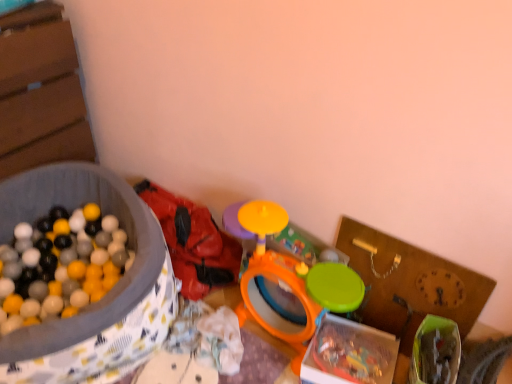
Question: Does translucent plastic box at center, positioned as the 2th box in left-to-right order, have a larger size compared to matte plastic ball pit at left, placed as the 2th box when sorted from right to left?

Choices:
 (A) no
 (B) yes

Answer: (A)

Question: Does translucent plastic box at center, positioned as the 1th box in right-to-left order, turn towards matte plastic ball pit at left, placed as the 2th box when sorted from right to left?

Choices:
 (A) yes
 (B) no

Answer: (B)

Question: From a real-world perspective, is translucent plastic box at center, positioned as the 1th box in right-to-left order, located beneath matte plastic ball pit at left, placed as the 2th box when sorted from right to left?

Choices:
 (A) yes
 (B) no

Answer: (A)

Question: Is translucent plastic box at center, positioned as the 2th box in left-to-right order, to the right of matte plastic ball pit at left, arranged as the first box when viewed from the left, from the viewer's perspective?

Choices:
 (A) yes
 (B) no

Answer: (A)

Question: Is translucent plastic box at center, positioned as the 2th box in left-to-right order, directly adjacent to matte plastic ball pit at left, placed as the 2th box when sorted from right to left?

Choices:
 (A) no
 (B) yes

Answer: (A)

Question: Considering the positions of point (438, 263) and point (356, 344), is point (438, 263) closer or farther from the camera than point (356, 344)?

Choices:
 (A) farther
 (B) closer

Answer: (B)

Question: From the image's perspective, relative to translucent plastic box at center, positioned as the 2th box in left-to-right order, is wooden clock at right above or below?

Choices:
 (A) below
 (B) above

Answer: (B)

Question: From a real-world perspective, is wooden clock at right positioned above or below translucent plastic box at center, positioned as the 1th box in right-to-left order?

Choices:
 (A) below
 (B) above

Answer: (B)

Question: Choose the correct answer: Is wooden clock at right inside translucent plastic box at center, positioned as the 1th box in right-to-left order, or outside it?

Choices:
 (A) inside
 (B) outside

Answer: (B)

Question: Is translucent plastic box at center, positioned as the 1th box in right-to-left order, in front of or behind orange plastic drum at center, the first toy viewed from the right, in the image?

Choices:
 (A) front
 (B) behind

Answer: (A)

Question: In terms of height, does translucent plastic box at center, positioned as the 2th box in left-to-right order, look taller or shorter compared to orange plastic drum at center, the first toy viewed from the right?

Choices:
 (A) short
 (B) tall

Answer: (A)

Question: Looking at the image, does translucent plastic box at center, positioned as the 1th box in right-to-left order, seem bigger or smaller compared to orange plastic drum at center, arranged as the 2th toy when viewed from the left?

Choices:
 (A) small
 (B) big

Answer: (A)

Question: From a real-world perspective, is translucent plastic box at center, positioned as the 1th box in right-to-left order, physically located above or below orange plastic drum at center, arranged as the 2th toy when viewed from the left?

Choices:
 (A) below
 (B) above

Answer: (A)

Question: Is matte plastic ball pit at left, arranged as the first box when viewed from the left, in front of or behind orange plastic drum at center, arranged as the 2th toy when viewed from the left, in the image?

Choices:
 (A) front
 (B) behind

Answer: (A)

Question: Is point (82, 380) positioned closer to the camera than point (246, 316)?

Choices:
 (A) closer
 (B) farther

Answer: (A)